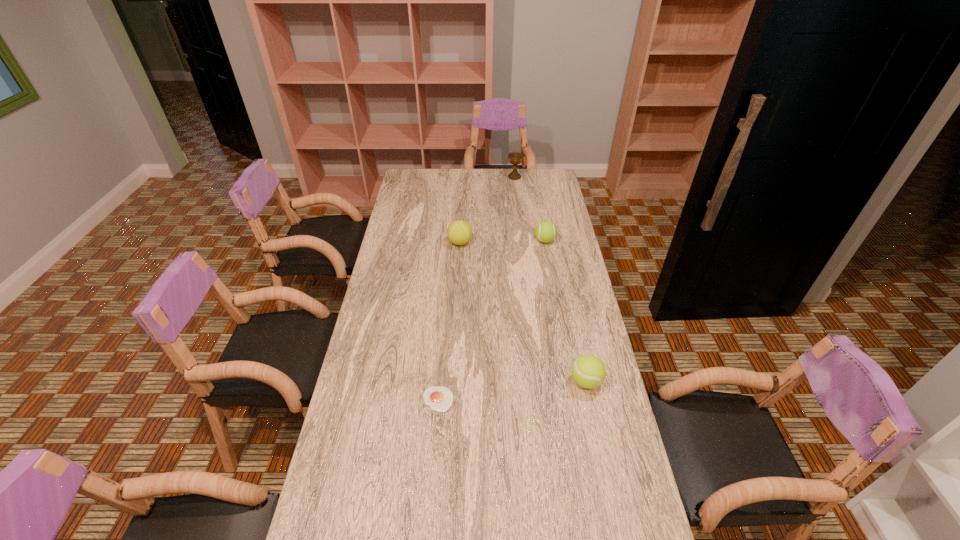
The width and height of the screenshot is (960, 540). I want to click on the tallest object, so click(515, 158).

Find the location of a particular element. Image resolution: width=960 pixels, height=540 pixels. the third object from left to right is located at coordinates (515, 158).

Locate an element on the screen. the leftmost tennis ball is located at coordinates (459, 232).

Locate an element on the screen. This screenshot has height=540, width=960. the nearest tennis ball is located at coordinates (588, 371).

Locate an element on the screen. This screenshot has height=540, width=960. egg yolk is located at coordinates (439, 398).

Identify the location of vacant space located 0.180m on the left of the tallest object. Image resolution: width=960 pixels, height=540 pixels. (473, 177).

Locate an element on the screen. free point located 0.170m on the back of the leftmost tennis ball is located at coordinates (462, 214).

At what (x,y) coordinates should I click in order to perform the action: click on vacant space located 0.340m on the left of the nearest tennis ball. Please return your answer as a coordinate pair (x, y). Looking at the image, I should click on (463, 381).

This screenshot has width=960, height=540. What are the coordinates of `vacant space located on the front of the shortest object` in the screenshot? It's located at (430, 500).

Locate an element on the screen. This screenshot has height=540, width=960. object positioned at the far edge is located at coordinates (515, 158).